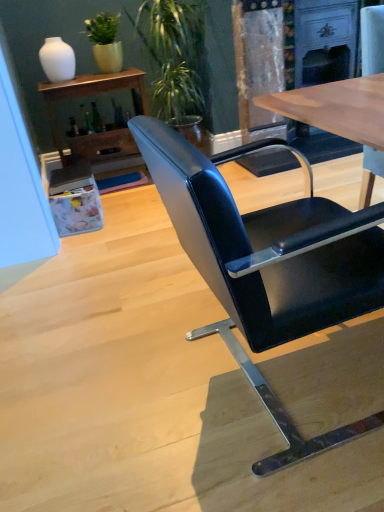
Where is `blank area to the left of black leather chair at center`? This screenshot has height=512, width=384. blank area to the left of black leather chair at center is located at coordinates (128, 378).